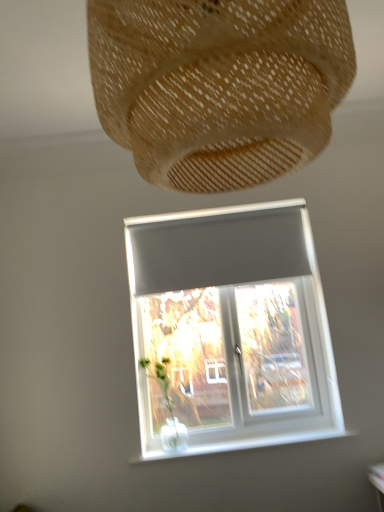
The height and width of the screenshot is (512, 384). What do you see at coordinates (219, 85) in the screenshot?
I see `bamboo woven lampshade at upper center` at bounding box center [219, 85].

Locate an element on the screen. bamboo woven lampshade at upper center is located at coordinates (219, 85).

Locate an element on the screen. This screenshot has width=384, height=512. bamboo woven lampshade at upper center is located at coordinates (219, 85).